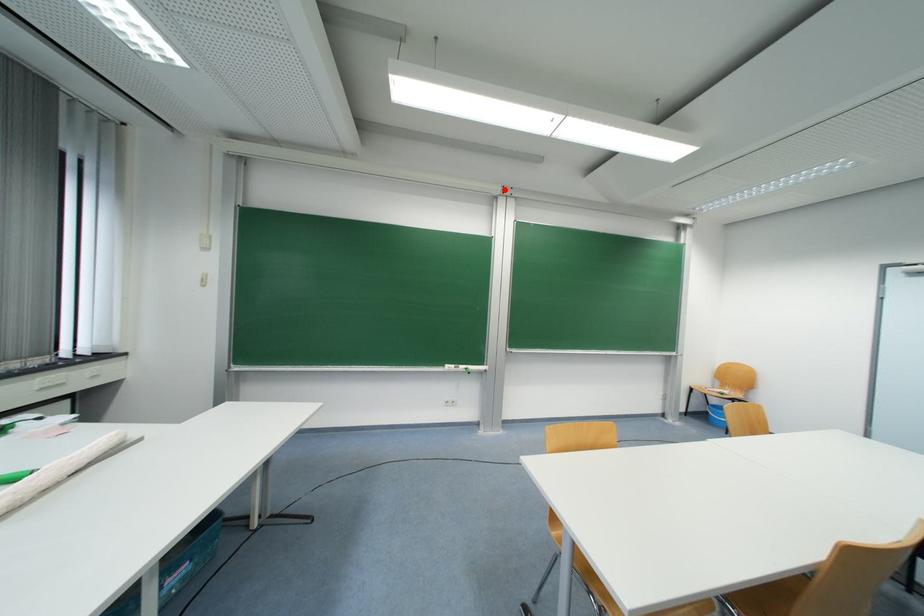
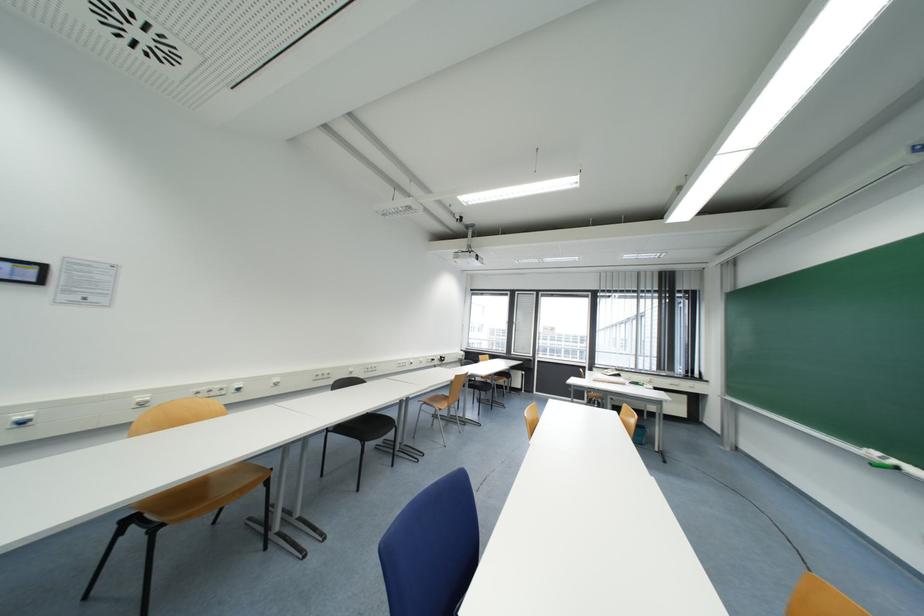
The point at the highlighted location is marked in the first image. Where is the corresponding point in the second image?

(909, 154)